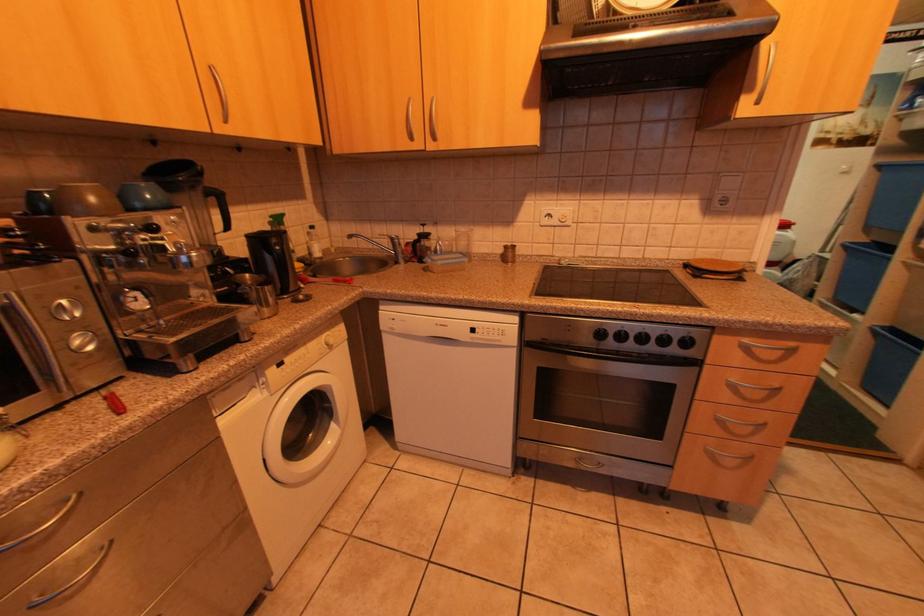
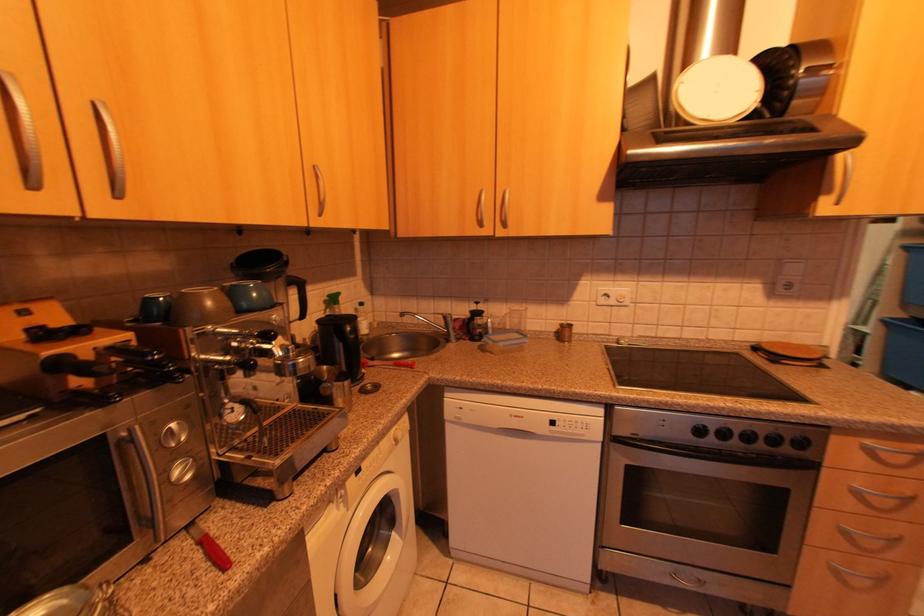
Question: What movement of the cameraman would produce the second image?

Choices:
 (A) Left
 (B) Right
 (C) Forward
 (D) Backward

Answer: (A)